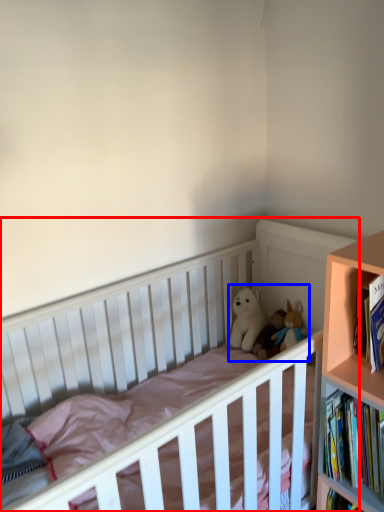
Question: Which object is closer to the camera taking this photo, infant bed (highlighted by a red box) or toy (highlighted by a blue box)?

Choices:
 (A) infant bed
 (B) toy

Answer: (A)